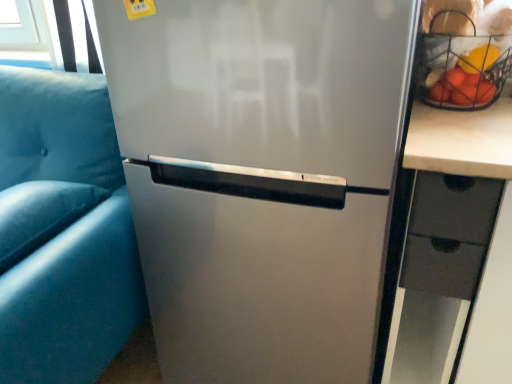
Question: From the image's perspective, does satin silver refrigerator at center appear higher than suede-like blue pillow at left?

Choices:
 (A) yes
 (B) no

Answer: (A)

Question: Is satin silver refrigerator at center at the left side of suede-like blue pillow at left?

Choices:
 (A) yes
 (B) no

Answer: (B)

Question: Does satin silver refrigerator at center have a lesser height compared to suede-like blue pillow at left?

Choices:
 (A) yes
 (B) no

Answer: (B)

Question: From a real-world perspective, is satin silver refrigerator at center located beneath suede-like blue pillow at left?

Choices:
 (A) yes
 (B) no

Answer: (A)

Question: Is satin silver refrigerator at center behind suede-like blue pillow at left?

Choices:
 (A) yes
 (B) no

Answer: (B)

Question: Is satin silver refrigerator at center thinner than suede-like blue pillow at left?

Choices:
 (A) no
 (B) yes

Answer: (A)

Question: From the image's perspective, is satin silver refrigerator at center over metallic wire basket at upper right?

Choices:
 (A) yes
 (B) no

Answer: (B)

Question: Considering the relative sizes of satin silver refrigerator at center and metallic wire basket at upper right in the image provided, is satin silver refrigerator at center thinner than metallic wire basket at upper right?

Choices:
 (A) no
 (B) yes

Answer: (A)

Question: Can you confirm if satin silver refrigerator at center is wider than metallic wire basket at upper right?

Choices:
 (A) yes
 (B) no

Answer: (A)

Question: Is satin silver refrigerator at center in contact with metallic wire basket at upper right?

Choices:
 (A) yes
 (B) no

Answer: (B)

Question: Can you confirm if satin silver refrigerator at center is positioned to the right of metallic wire basket at upper right?

Choices:
 (A) no
 (B) yes

Answer: (A)

Question: Does satin silver refrigerator at center appear on the left side of metallic wire basket at upper right?

Choices:
 (A) no
 (B) yes

Answer: (B)

Question: Is metallic wire basket at upper right taller than suede-like blue pillow at left?

Choices:
 (A) yes
 (B) no

Answer: (A)